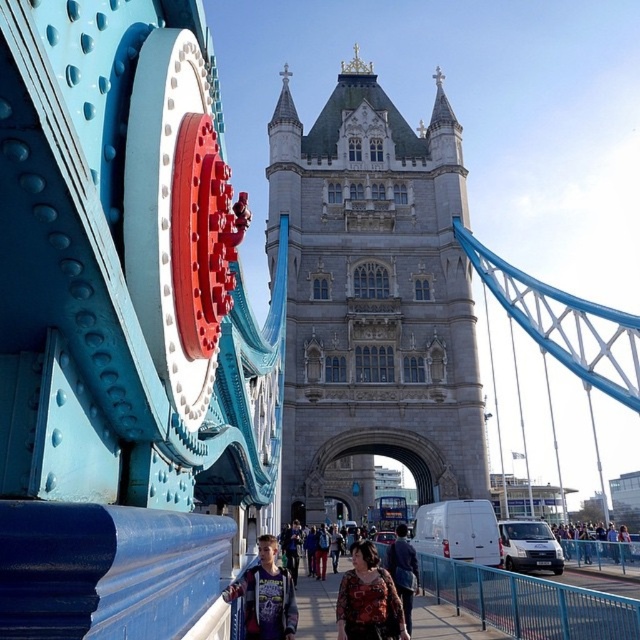
You are standing on the blue suspension bridge and looking towards the gray stone tower at center and the floral fabric dress at center. Which object is positioned higher from your viewpoint?

The gray stone tower at center is positioned higher than the floral fabric dress at center from your viewpoint.

You are a delivery person with a 2.5 meter wide cart. You need to deliver a package to the Tower Bridge tower. You see the matte blue pavement at center and the dark blue jacket at center. Can your cart fit between them?

The distance between the matte blue pavement at center and the dark blue jacket at center is 7.46 meters. Since your cart is only 2.5 meters wide, it can easily fit between them as the space is more than double the cart width.